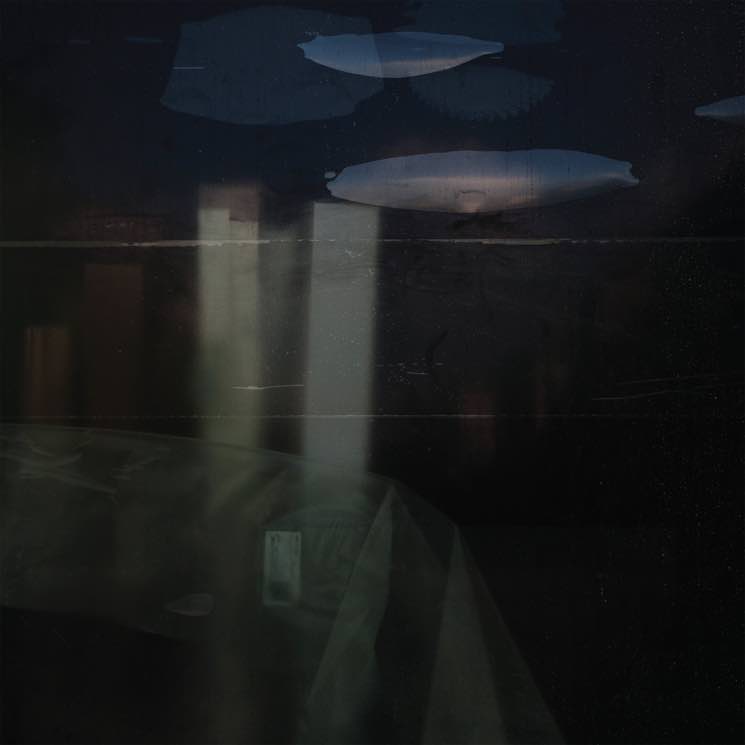
You are a GUI agent. You are given a task and a screenshot of the screen. Output one action in this format:
    pyautogui.click(x=<x>, y=<y>)
    Task: Click on the water stain
    The image size is (745, 745).
    Given the screenshot: What is the action you would take?
    pyautogui.click(x=190, y=605)